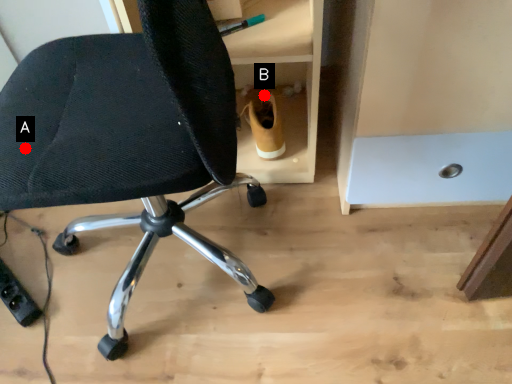
Question: Two points are circled on the image, labeled by A and B beside each circle. Which point is farther from the camera taking this photo?

Choices:
 (A) A is further
 (B) B is further

Answer: (B)